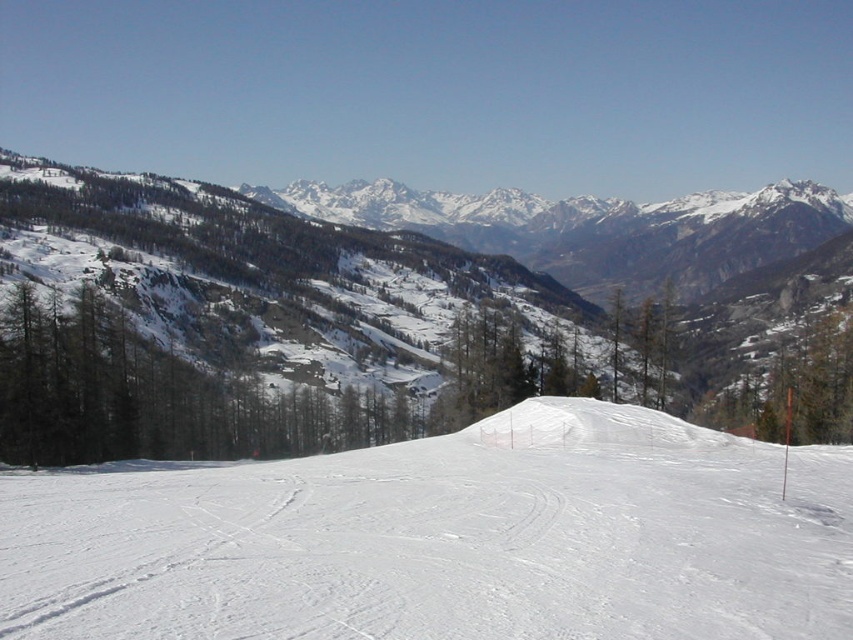
Question: Which of the following is the closest to the observer?

Choices:
 (A) (450, 540)
 (B) (773, 419)

Answer: (A)

Question: Which of the following is the closest to the observer?

Choices:
 (A) (550, 580)
 (B) (750, 429)
 (C) (51, 452)

Answer: (A)

Question: Which point appears farthest from the camera in this image?

Choices:
 (A) (170, 401)
 (B) (587, 481)

Answer: (A)

Question: From the image, what is the correct spatial relationship of white snow ski slope at center in relation to green matte tree at right?

Choices:
 (A) above
 (B) below

Answer: (B)

Question: Considering the relative positions of green matte trees at left and green matte tree at right in the image provided, where is green matte trees at left located with respect to green matte tree at right?

Choices:
 (A) above
 (B) below

Answer: (B)

Question: Can you confirm if green matte trees at left is positioned to the left of green matte tree at right?

Choices:
 (A) no
 (B) yes

Answer: (B)